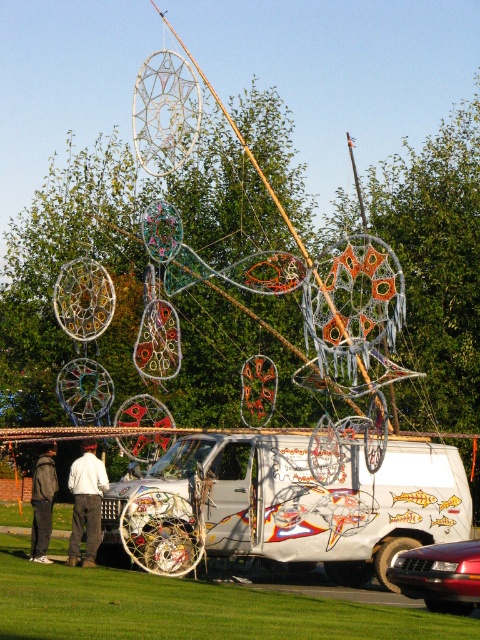
Which is more to the left, white matte van at center or white cotton pants at lower left?

white cotton pants at lower left is more to the left.

Image resolution: width=480 pixels, height=640 pixels. What do you see at coordinates (285, 506) in the screenshot?
I see `white matte van at center` at bounding box center [285, 506].

Is point (342, 509) in front of point (74, 560)?

That is True.

The image size is (480, 640). Identify the location of white matte van at center. (285, 506).

Which of these two, white matte van at center or dark gray hoodie at lower left, stands taller?

dark gray hoodie at lower left

Can you confirm if white matte van at center is positioned above dark gray hoodie at lower left?

Incorrect, white matte van at center is not positioned above dark gray hoodie at lower left.

Does point (254, 468) come closer to viewer compared to point (31, 500)?

Yes, point (254, 468) is in front of point (31, 500).

You are a GUI agent. You are given a task and a screenshot of the screen. Output one action in this format:
    pyautogui.click(x=<x>, y=<y>)
    Task: Click on the white matte van at center
    The width and height of the screenshot is (480, 640).
    Given the screenshot: What is the action you would take?
    pyautogui.click(x=285, y=506)

Does shiny red car at lower right appear over white cotton pants at lower left?

No.

Is point (409, 557) less distant than point (87, 488)?

Yes, it is.

Who is more distant from viewer, [456,570] or [101,483]?

Positioned behind is point [101,483].

You are a GUI agent. You are given a task and a screenshot of the screen. Output one action in this format:
    pyautogui.click(x=<x>, y=<y>)
    Task: Click on the shiny red car at lower right
    Image resolution: width=480 pixels, height=640 pixels.
    Given the screenshot: What is the action you would take?
    pyautogui.click(x=441, y=576)